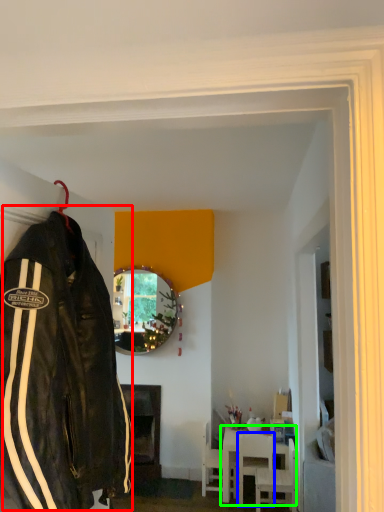
Question: Considering the real-world distances, which object is farthest from jacket (highlighted by a red box)? chair (highlighted by a blue box) or table (highlighted by a green box)?

Choices:
 (A) chair
 (B) table

Answer: (B)